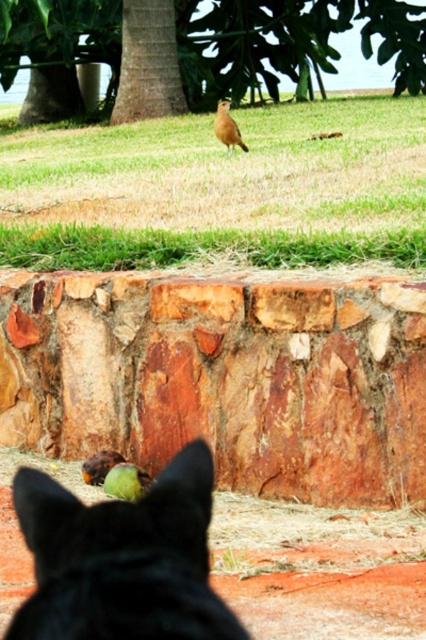
Is green grass at center bigger than brown matte bird at upper center?

Indeed, green grass at center has a larger size compared to brown matte bird at upper center.

The height and width of the screenshot is (640, 426). I want to click on green grass at center, so click(x=221, y=189).

Who is more forward, (x=146, y=182) or (x=227, y=145)?

Positioned in front is point (x=146, y=182).

Find the location of a particular element. green grass at center is located at coordinates (221, 189).

From the picture: Can you confirm if green leafy tree at upper center is thinner than brown matte bird at upper center?

In fact, green leafy tree at upper center might be wider than brown matte bird at upper center.

Does point (207, 1) lie behind point (227, 132)?

That is True.

The width and height of the screenshot is (426, 640). I want to click on green leafy tree at upper center, so click(x=356, y=65).

Does green grass at center have a smaller size compared to black fur cat at center?

No.

Describe the element at coordinates (221, 189) in the screenshot. I see `green grass at center` at that location.

Is point (97, 150) in front of point (183, 588)?

No.

Where is `green grass at center`? The width and height of the screenshot is (426, 640). green grass at center is located at coordinates (221, 189).